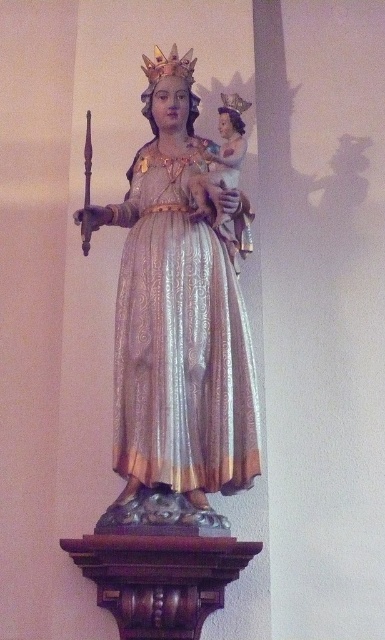
Question: Which point is closer to the camera?

Choices:
 (A) silvery metallic dress at center
 (B) shiny gold statue at center

Answer: (B)

Question: Does shiny gold statue at center have a larger size compared to silvery metallic dress at center?

Choices:
 (A) no
 (B) yes

Answer: (B)

Question: Where is shiny gold statue at center located in relation to silvery metallic dress at center in the image?

Choices:
 (A) left
 (B) right

Answer: (A)

Question: Is shiny gold statue at center to the left of silvery metallic dress at center from the viewer's perspective?

Choices:
 (A) no
 (B) yes

Answer: (B)